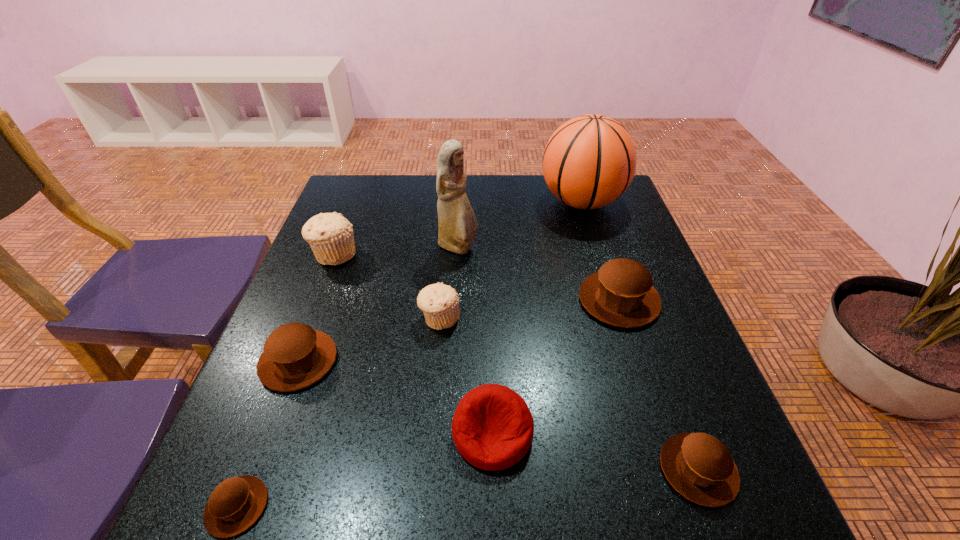
Where is `free spot between the smallest brown muffin and the nearer beige muffin`? free spot between the smallest brown muffin and the nearer beige muffin is located at coordinates (339, 413).

Find the location of a particular element. The height and width of the screenshot is (540, 960). free space between the figurine and the bigger beige muffin is located at coordinates (396, 251).

Locate an element on the screen. This screenshot has width=960, height=540. vacant space that's between the smaller beige muffin and the left beige muffin is located at coordinates (387, 286).

Locate which object is the second closest to the biggest brown muffin. Please provide its 2D coordinates. Your answer should be formatted as a tuple, i.e. [(x, y)], where the tuple contains the x and y coordinates of a point satisfying the conditions above.

[(493, 428)]

Identify which object is the fifth nearest to the farther beige muffin. Please provide its 2D coordinates. Your answer should be formatted as a tuple, i.e. [(x, y)], where the tuple contains the x and y coordinates of a point satisfying the conditions above.

[(589, 161)]

Identify which muffin is the sixth nearest to the beanbag. Please provide its 2D coordinates. Your answer should be formatted as a tuple, i.e. [(x, y)], where the tuple contains the x and y coordinates of a point satisfying the conditions above.

[(330, 235)]

Identify the location of muffin object that ranks as the fifth closest to the third biggest brown muffin. The width and height of the screenshot is (960, 540). (330, 235).

Locate an element on the screen. This screenshot has height=540, width=960. brown muffin object that ranks as the closest to the farthest object is located at coordinates (621, 293).

Identify the location of brown muffin that can be found as the third closest to the beanbag. (295, 356).

Find the location of a particular element. blank space that satisfies the following two spatial constraints: 1. on the seat area of the beanbag; 2. on the right side of the second shortest muffin is located at coordinates (493, 469).